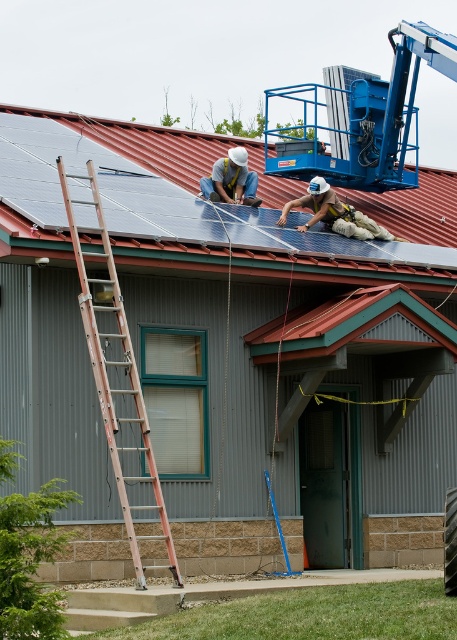
Question: Considering the relative positions of white hard hat at upper center and matte white helmet at upper center in the image provided, where is white hard hat at upper center located with respect to matte white helmet at upper center?

Choices:
 (A) right
 (B) left

Answer: (A)

Question: Which object is closer to the camera taking this photo?

Choices:
 (A) orange metallic ladder at left
 (B) metallic solar panels at upper center
 (C) matte white helmet at upper center
 (D) white hard hat at upper center

Answer: (A)

Question: Among these objects, which one is nearest to the camera?

Choices:
 (A) white hard hat at upper center
 (B) metallic solar panels at upper center
 (C) matte white helmet at upper center
 (D) orange metallic ladder at left

Answer: (D)

Question: Does metallic solar panels at upper center have a lesser width compared to orange metallic ladder at left?

Choices:
 (A) yes
 (B) no

Answer: (B)

Question: Among these objects, which one is nearest to the camera?

Choices:
 (A) metallic solar panels at upper center
 (B) matte white helmet at upper center
 (C) white hard hat at upper center

Answer: (A)

Question: Does orange metallic ladder at left appear over matte white helmet at upper center?

Choices:
 (A) no
 (B) yes

Answer: (A)